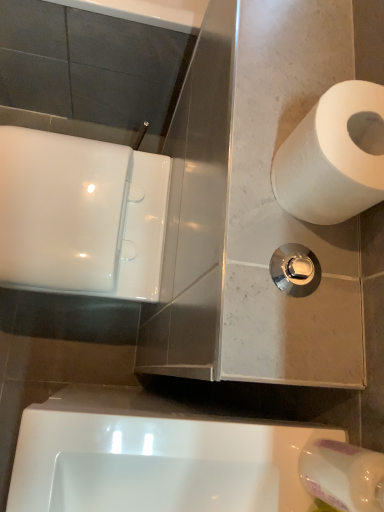
The image size is (384, 512). I want to click on free space on the front side of white paper at right, placed as the second toilet paper when sorted from bottom to top, so click(261, 276).